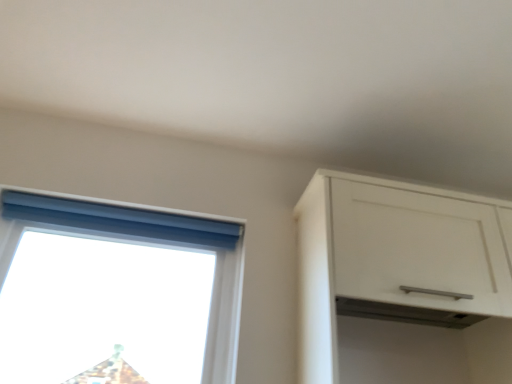
Question: In the image, is blue fabric curtain at upper left positioned in front of or behind white matte cabinet at upper right?

Choices:
 (A) front
 (B) behind

Answer: (B)

Question: Looking at their shapes, would you say blue fabric curtain at upper left is wider or thinner than white matte cabinet at upper right?

Choices:
 (A) thin
 (B) wide

Answer: (A)

Question: Based on their relative distances, which object is nearer to the transparent plastic window at upper left?

Choices:
 (A) white matte cabinet at upper right
 (B) blue fabric curtain at upper left

Answer: (B)

Question: Which object is the farthest from the transparent plastic window at upper left?

Choices:
 (A) white matte cabinet at upper right
 (B) blue fabric curtain at upper left

Answer: (A)